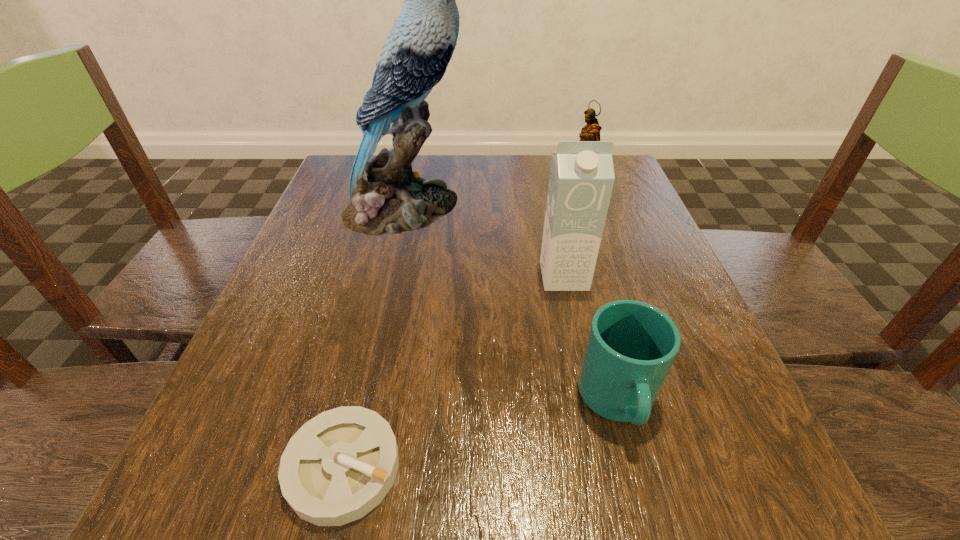
Locate an element on the screen. free space located on the front-facing side of the figurine is located at coordinates pyautogui.click(x=483, y=200).

The height and width of the screenshot is (540, 960). In order to click on vacant point located 0.050m on the handle side of the cup in this screenshot , I will do `click(640, 490)`.

Identify the location of free space located 0.200m on the right of the shortest object. This screenshot has width=960, height=540. click(x=557, y=467).

Find the location of a particular element. parakeet that is at the far edge is located at coordinates pyautogui.click(x=387, y=197).

Locate an element on the screen. figurine positioned at the far edge is located at coordinates (591, 132).

Locate an element on the screen. Image resolution: width=960 pixels, height=540 pixels. object present at the near edge is located at coordinates (338, 466).

Identify the location of parakeet that is at the left edge. (387, 197).

In order to click on ashtray located in the left edge section of the desktop in this screenshot , I will do `click(338, 466)`.

This screenshot has height=540, width=960. What are the coordinates of `figurine located in the right edge section of the desktop` in the screenshot? It's located at (591, 132).

At what (x,y) coordinates should I click in order to perform the action: click on cup present at the right edge. Please return your answer as a coordinate pair (x, y). The width and height of the screenshot is (960, 540). Looking at the image, I should click on (631, 346).